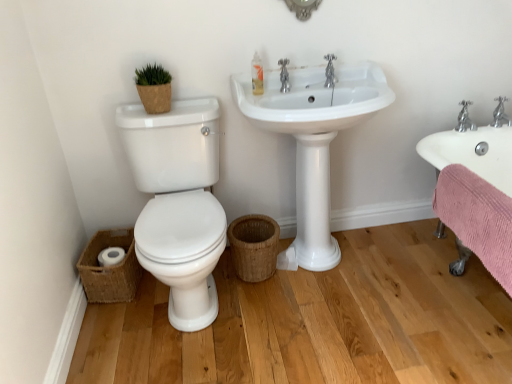
You are a GUI agent. You are given a task and a screenshot of the screen. Output one action in this format:
    pyautogui.click(x=<x>, y=<y>)
    Task: Click on the free location in front of white glossy sink at center, the first sink positioned from the left
    Image resolution: width=512 pixels, height=384 pixels.
    Given the screenshot: What is the action you would take?
    pyautogui.click(x=339, y=334)